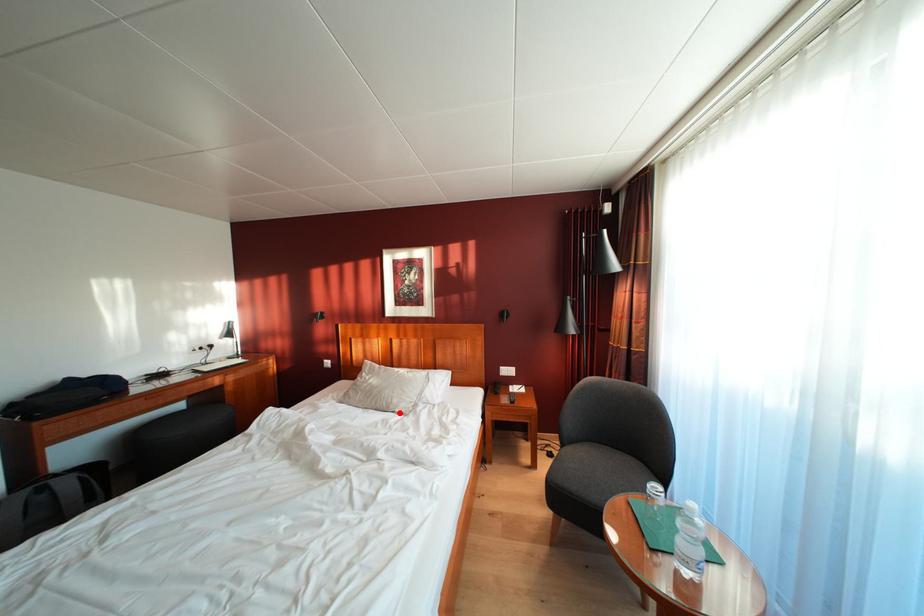
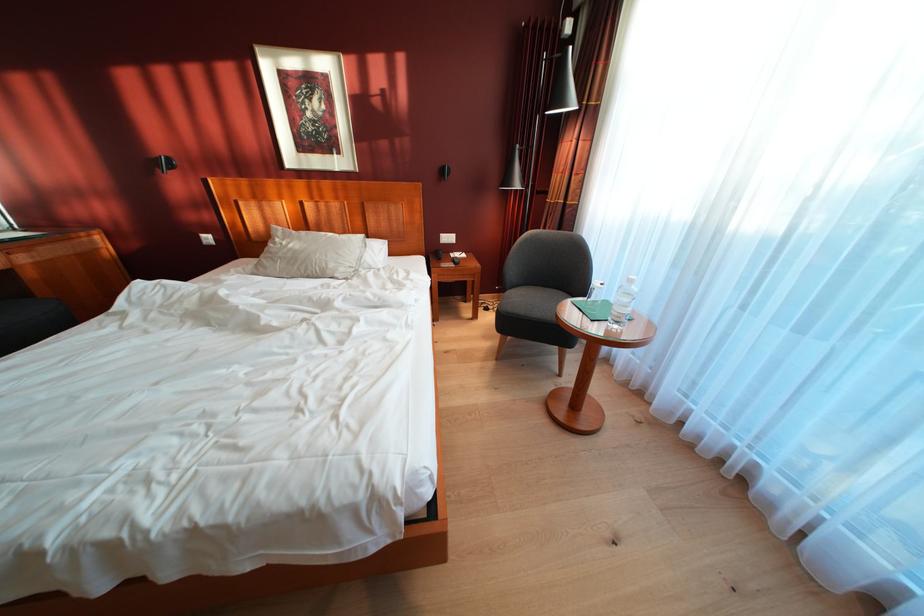
Find the pixel in the second image that matches the highlighted location in the first image.

(336, 278)